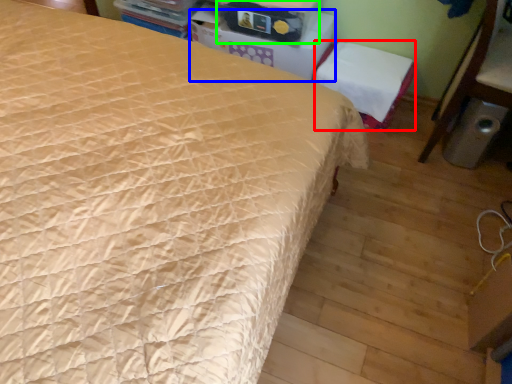
Question: Based on their relative distances, which object is nearer to chair (highlighted by a red box)? Choose from table (highlighted by a blue box) and storage box (highlighted by a green box).

Choices:
 (A) table
 (B) storage box

Answer: (A)